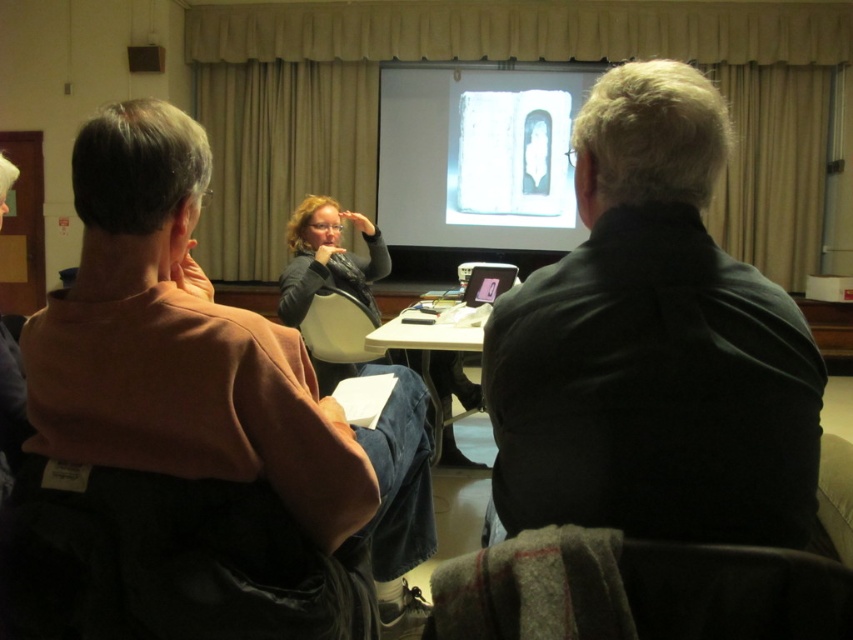
Question: Is the position of dark gray shirt at center more distant than that of white matte projection screen at center?

Choices:
 (A) no
 (B) yes

Answer: (A)

Question: Is dark gray shirt at center behind white plastic table at center?

Choices:
 (A) no
 (B) yes

Answer: (A)

Question: Estimate the real-world distances between objects in this image. Which object is farther from the white plastic table at center?

Choices:
 (A) dark gray shirt at center
 (B) white matte projection screen at center

Answer: (B)

Question: Based on their relative distances, which object is nearer to the white plastic table at center?

Choices:
 (A) brown cotton shirt at left
 (B) dark gray shirt at center
 (C) white matte projection screen at center

Answer: (A)

Question: Is dark gray shirt at center to the left of brown cotton shirt at left from the viewer's perspective?

Choices:
 (A) no
 (B) yes

Answer: (A)

Question: Based on their relative distances, which object is nearer to the brown cotton shirt at left?

Choices:
 (A) white matte projection screen at center
 (B) dark gray shirt at center
 (C) white plastic table at center

Answer: (B)